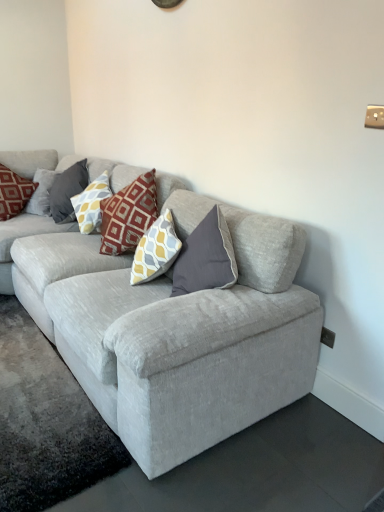
Question: From a real-world perspective, is light gray fabric couch at center positioned under yellow and gray patterned pillow at upper left, the 2th pillow in the right-to-left sequence, based on gravity?

Choices:
 (A) no
 (B) yes

Answer: (B)

Question: Is light gray fabric couch at center positioned far away from yellow and gray patterned pillow at upper left, the 2th pillow in the right-to-left sequence?

Choices:
 (A) no
 (B) yes

Answer: (B)

Question: Is the position of light gray fabric couch at center less distant than that of yellow and gray patterned pillow at upper left, the 2th pillow in the right-to-left sequence?

Choices:
 (A) no
 (B) yes

Answer: (B)

Question: Is light gray fabric couch at center located outside yellow and gray patterned pillow at upper left, the 2th pillow in the right-to-left sequence?

Choices:
 (A) no
 (B) yes

Answer: (B)

Question: Is yellow and gray patterned pillow at upper left, the 2th pillow in the right-to-left sequence, at the back of light gray fabric couch at center?

Choices:
 (A) no
 (B) yes

Answer: (B)

Question: Is yellow and gray patterned pillow at center, the 3th pillow when ordered from left to right, bigger or smaller than light gray fabric couch at center?

Choices:
 (A) big
 (B) small

Answer: (B)

Question: In terms of height, does yellow and gray patterned pillow at center, the 3th pillow when ordered from left to right, look taller or shorter compared to light gray fabric couch at center?

Choices:
 (A) tall
 (B) short

Answer: (B)

Question: Considering the relative positions of yellow and gray patterned pillow at center, the 3th pillow when ordered from left to right, and light gray fabric couch at center in the image provided, is yellow and gray patterned pillow at center, the 3th pillow when ordered from left to right, to the left or to the right of light gray fabric couch at center?

Choices:
 (A) right
 (B) left

Answer: (A)

Question: Is point (107, 185) closer or farther from the camera than point (253, 224)?

Choices:
 (A) farther
 (B) closer

Answer: (A)

Question: From the image's perspective, is light gray fabric couch at center located above or below yellow and gray patterned pillow at upper left, the second pillow from the left?

Choices:
 (A) above
 (B) below

Answer: (B)

Question: From their relative heights in the image, would you say light gray fabric couch at center is taller or shorter than yellow and gray patterned pillow at upper left, the 2th pillow in the right-to-left sequence?

Choices:
 (A) short
 (B) tall

Answer: (B)

Question: Is light gray fabric couch at center in front of or behind yellow and gray patterned pillow at upper left, the second pillow from the left, in the image?

Choices:
 (A) behind
 (B) front

Answer: (B)

Question: In terms of size, does light gray fabric couch at center appear bigger or smaller than yellow and gray patterned pillow at upper left, the 2th pillow in the right-to-left sequence?

Choices:
 (A) big
 (B) small

Answer: (A)

Question: Considering the positions of yellow and gray patterned pillow at upper left, the second pillow from the left, and light gray fabric couch at center in the image, is yellow and gray patterned pillow at upper left, the second pillow from the left, bigger or smaller than light gray fabric couch at center?

Choices:
 (A) big
 (B) small

Answer: (B)

Question: In terms of height, does yellow and gray patterned pillow at upper left, the 2th pillow in the right-to-left sequence, look taller or shorter compared to light gray fabric couch at center?

Choices:
 (A) short
 (B) tall

Answer: (A)